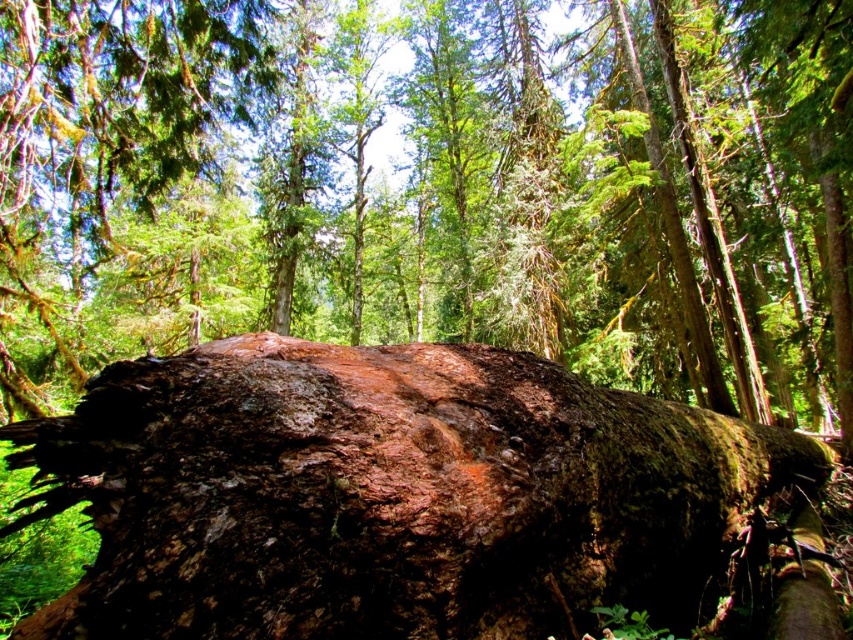
Does rough bark tree trunk at center appear on the right side of rusty metallic boulder at center?

Incorrect, rough bark tree trunk at center is not on the right side of rusty metallic boulder at center.

Is rough bark tree trunk at center further to camera compared to rusty metallic boulder at center?

Yes, it is.

Who is more distant from viewer, (808,401) or (712,513)?

The point (808,401) is more distant.

This screenshot has height=640, width=853. Find the location of `rough bark tree trunk at center`. rough bark tree trunk at center is located at coordinates (436, 188).